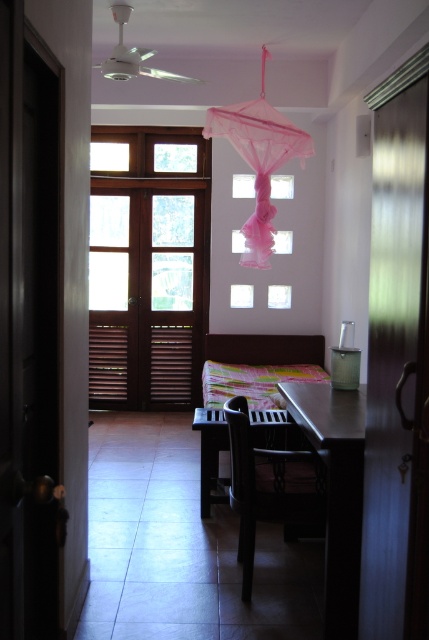
Identify the location of metallic dark brown table at center. Image resolution: width=429 pixels, height=640 pixels. (335, 490).

Is point (328, 451) positioned in front of point (201, 445)?

Yes, it is.

Does point (338, 538) lie behind point (210, 481)?

No, (338, 538) is closer to viewer.

Identify the location of metallic dark brown table at center. This screenshot has width=429, height=640. (335, 490).

Between metallic dark brown table at center and pink tulle umbrella at upper center, which one is positioned lower?

metallic dark brown table at center

Is metallic dark brown table at center smaller than pink tulle umbrella at upper center?

Yes.

Is point (329, 497) less distant than point (250, 104)?

Yes, it is.

Image resolution: width=429 pixels, height=640 pixels. I want to click on metallic dark brown table at center, so click(x=335, y=490).

How much distance is there between metallic dark brown table at center and black matte chair at center?

metallic dark brown table at center is 12.27 inches from black matte chair at center.

Who is higher up, metallic dark brown table at center or black matte chair at center?

metallic dark brown table at center is above.

Is point (331, 616) positioned before point (280, 472)?

Yes.

This screenshot has width=429, height=640. Find the location of `metallic dark brown table at center`. metallic dark brown table at center is located at coordinates (335, 490).